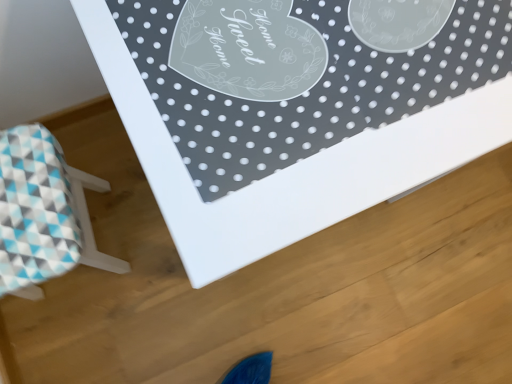
Locate an element on the screen. This screenshot has width=512, height=384. free spot in front of blue checkered stool at lower left is located at coordinates (73, 338).